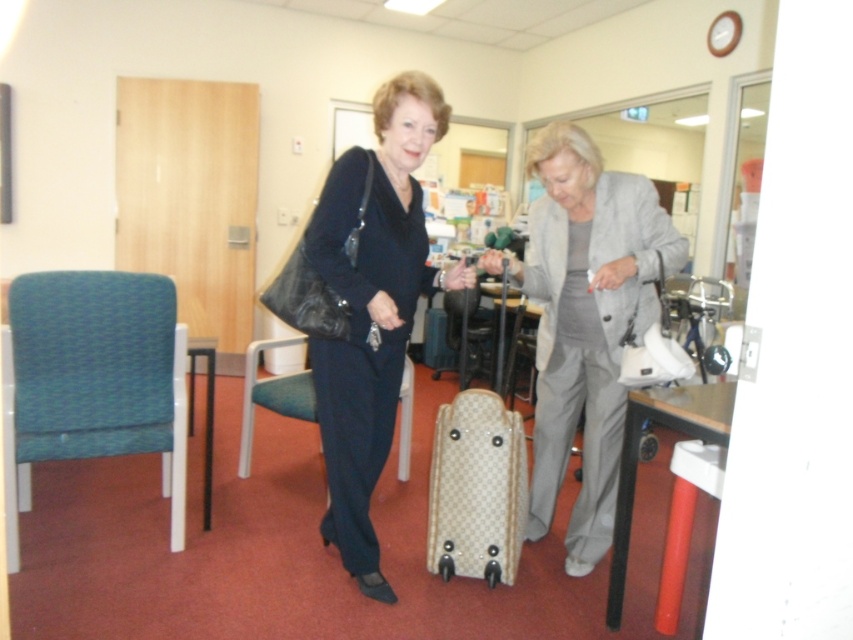
You are a fashion designer who needs to place a 30 inch wide dress mannequin between the matte black dress at center and the teal fabric chair at left. Can you fit it there?

The distance between the matte black dress at center and the teal fabric chair at left is 29.98 inches, so the 30 inch wide dress mannequin cannot fit there as it is slightly wider than the available space.